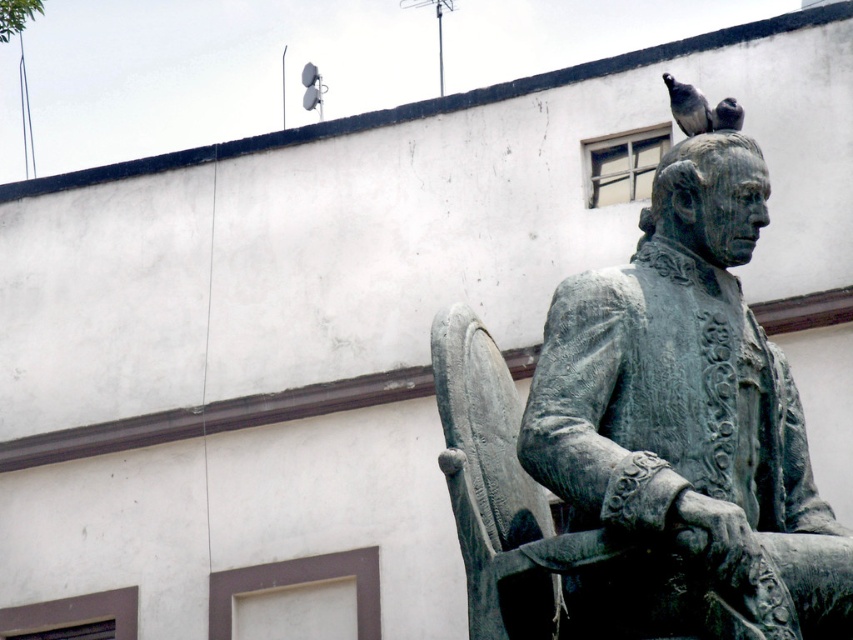
Question: Which object is positioned closest to the dark gray feathers at upper center?

Choices:
 (A) gray matte bird at upper right
 (B) bronze statue at upper right

Answer: (A)

Question: Considering the real-world distances, which object is farthest from the dark gray feathers at upper center?

Choices:
 (A) bronze statue at upper right
 (B) gray matte bird at upper right

Answer: (A)

Question: Is bronze statue at upper right positioned before gray matte bird at upper right?

Choices:
 (A) no
 (B) yes

Answer: (B)

Question: Is bronze statue at upper right to the right of gray matte bird at upper right from the viewer's perspective?

Choices:
 (A) yes
 (B) no

Answer: (B)

Question: Can you confirm if bronze statue at upper right is thinner than gray matte bird at upper right?

Choices:
 (A) no
 (B) yes

Answer: (A)

Question: Which object is positioned closest to the bronze statue at upper right?

Choices:
 (A) dark gray feathers at upper center
 (B) gray matte bird at upper right

Answer: (B)